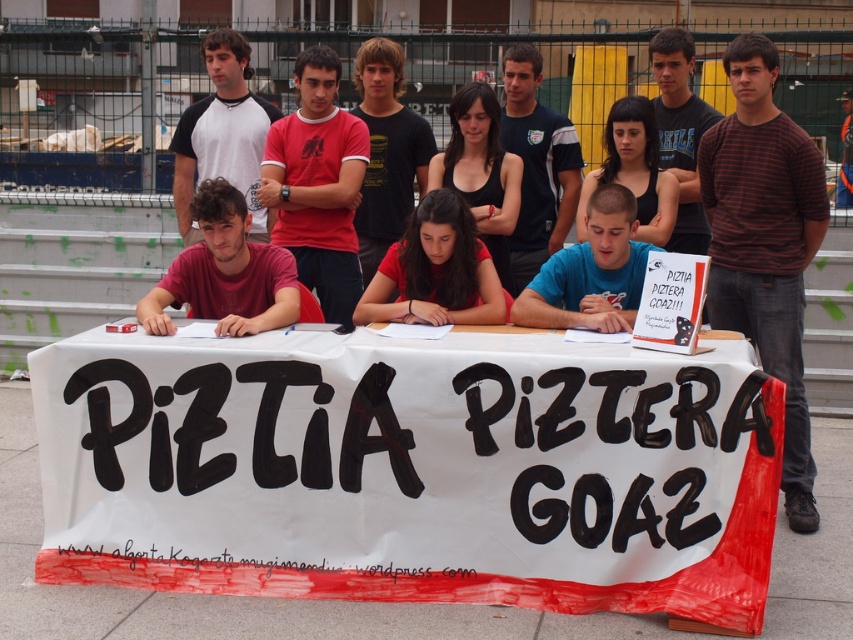
Who is more distant from viewer, (404, 369) or (639, 237)?

Point (639, 237)

Which of these two, white paper table at center or matte black tank top at center, stands shorter?

With less height is matte black tank top at center.

Between point (598, 404) and point (637, 144), which one is positioned behind?

Positioned behind is point (637, 144).

Locate an element on the screen. white paper table at center is located at coordinates (412, 472).

Is point (73, 541) positioned before point (447, 193)?

Yes, point (73, 541) is in front of point (447, 193).

Measure the distance between point [73,564] and camera.

Point [73,564] is 4.84 meters from camera.

The image size is (853, 640). Identify the location of white paper table at center. (412, 472).

Which is below, matte red shirt at center or matte black tank top at center?

matte red shirt at center is below.

Is matte red shirt at center closer to camera compared to matte black tank top at center?

Yes.

The image size is (853, 640). Identify the location of matte red shirt at center. (436, 272).

What are the coordinates of `matte red shirt at center` in the screenshot? It's located at (436, 272).